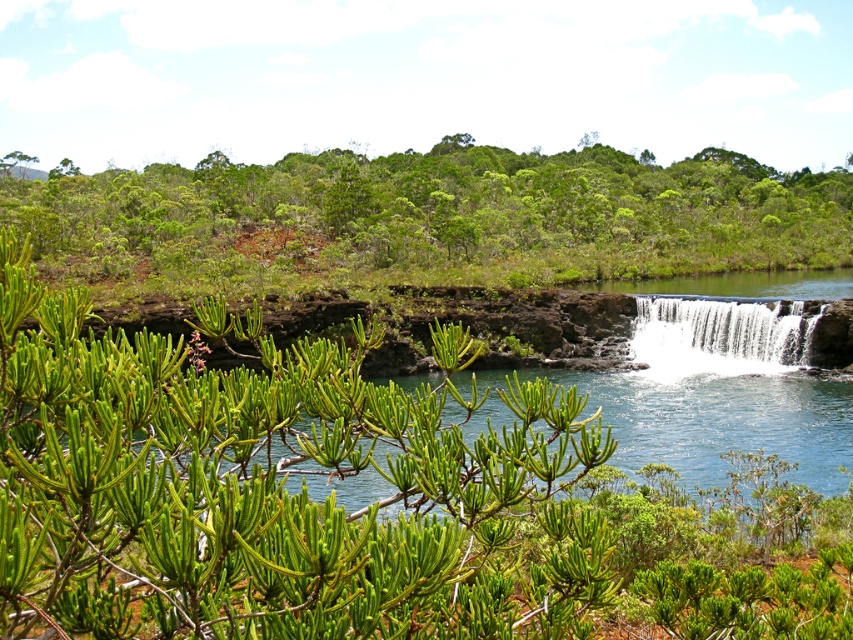
Question: Which point appears closest to the camera in this image?

Choices:
 (A) (74, 230)
 (B) (637, 305)
 (C) (331, 522)

Answer: (C)

Question: Which of the following is the farthest from the observer?

Choices:
 (A) (437, 563)
 (B) (28, 164)
 (C) (666, 355)

Answer: (B)

Question: Can you confirm if green leafy trees at upper center is positioned to the left of green matte tree at upper left?

Choices:
 (A) no
 (B) yes

Answer: (A)

Question: Is green leafy trees at upper center closer to camera compared to green matte tree at upper left?

Choices:
 (A) yes
 (B) no

Answer: (A)

Question: Which is nearer to the white frothy water at lower right?

Choices:
 (A) green matte tree at upper left
 (B) green leafy shrub at center
 (C) green leafy trees at upper center

Answer: (B)

Question: Does white frothy water at lower right appear under green matte tree at upper left?

Choices:
 (A) yes
 (B) no

Answer: (A)